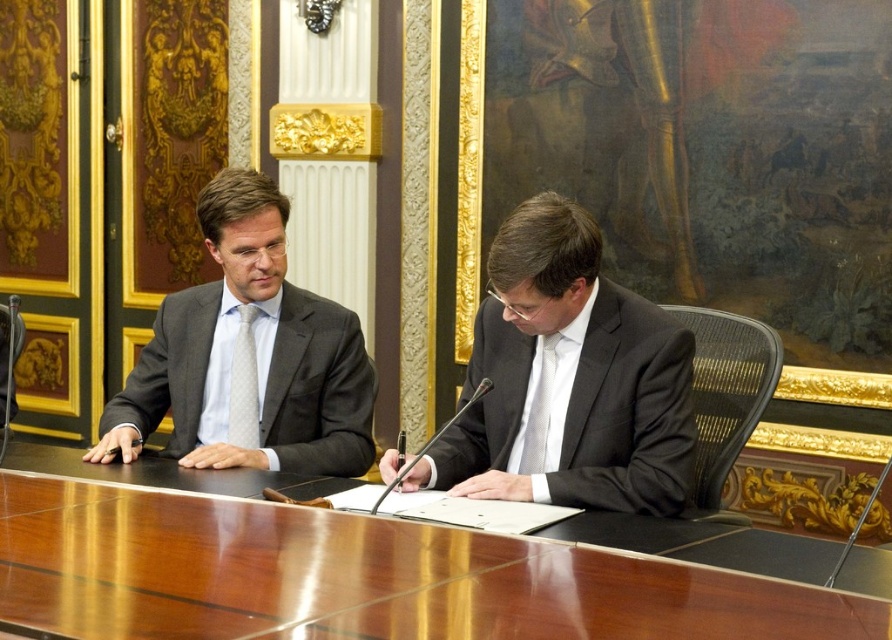
Does matte black suit at center appear under white silk tie at center?

Actually, matte black suit at center is above white silk tie at center.

What do you see at coordinates (568, 380) in the screenshot?
I see `matte black suit at center` at bounding box center [568, 380].

Is point (678, 394) closer to camera compared to point (530, 452)?

Yes, it is in front of point (530, 452).

I want to click on matte black suit at center, so click(568, 380).

Is point (248, 236) positioned before point (241, 413)?

Yes, point (248, 236) is in front of point (241, 413).

Who is more distant from viewer, [230,243] or [248,360]?

Point [248,360]

You are a GUI agent. You are given a task and a screenshot of the screen. Output one action in this format:
    pyautogui.click(x=<x>, y=<y>)
    Task: Click on the matte gray suit at left
    This screenshot has height=640, width=892.
    Given the screenshot: What is the action you would take?
    pyautogui.click(x=250, y=358)

In order to click on matte gray suit at left in this screenshot , I will do `click(250, 358)`.

Does white dotted tie at left come behind white silk tie at center?

Yes, it is behind white silk tie at center.

In the scene shown: Between white dotted tie at left and white silk tie at center, which one is positioned higher?

Positioned higher is white dotted tie at left.

Which is behind, point (235, 410) or point (549, 404)?

The point (235, 410) is behind.

Locate an element on the screen. This screenshot has height=640, width=892. white dotted tie at left is located at coordinates (244, 385).